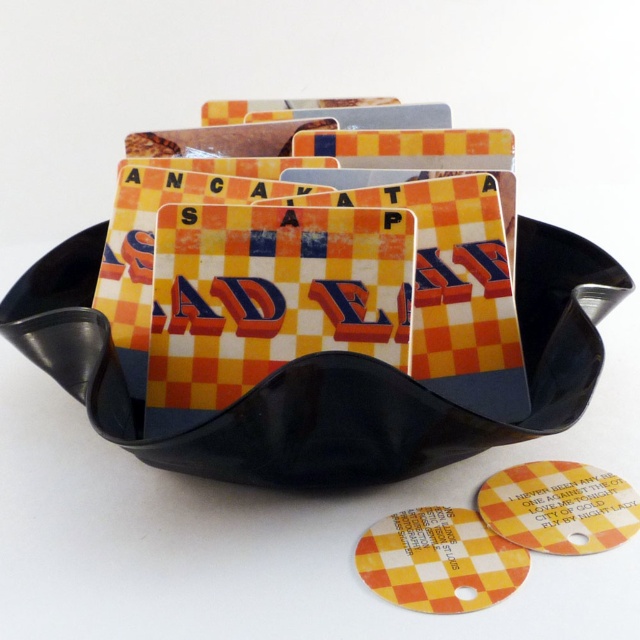
Is yellow checkered card at center taller than yellow checkered coaster at center?

Yes.

Who is positioned more to the right, yellow checkered card at center or yellow checkered coaster at center?

From the viewer's perspective, yellow checkered coaster at center appears more on the right side.

Describe the element at coordinates (326, 378) in the screenshot. Image resolution: width=640 pixels, height=640 pixels. I see `yellow checkered card at center` at that location.

You are a GUI agent. You are given a task and a screenshot of the screen. Output one action in this format:
    pyautogui.click(x=<x>, y=<y>)
    Task: Click on the yellow checkered card at center
    
    Given the screenshot: What is the action you would take?
    pyautogui.click(x=326, y=378)

Is yellow checkered card at center taller than yellow checkered chip at center?

Yes.

Does yellow checkered card at center appear on the right side of yellow checkered chip at center?

In fact, yellow checkered card at center is to the left of yellow checkered chip at center.

The image size is (640, 640). What do you see at coordinates (326, 378) in the screenshot?
I see `yellow checkered card at center` at bounding box center [326, 378].

Where is `yellow checkered card at center`? This screenshot has height=640, width=640. yellow checkered card at center is located at coordinates (326, 378).

Who is more forward, (460, 556) or (552, 481)?

Point (460, 556)

Locate an element on the screen. Image resolution: width=640 pixels, height=640 pixels. yellow checkered chip at center is located at coordinates (438, 561).